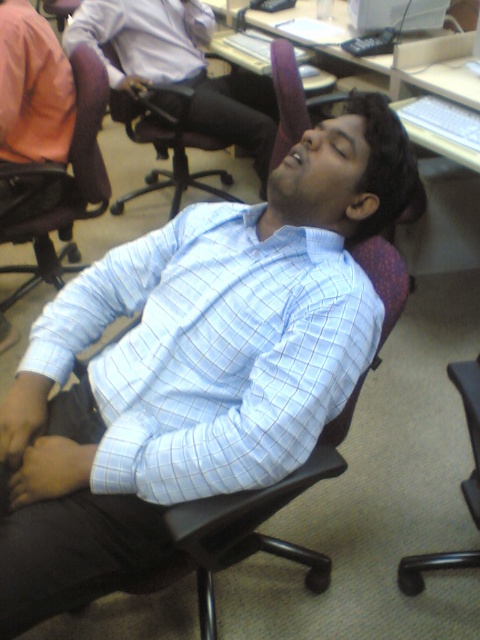
In the office scene, there is a point at coordinates [178,67]. Which object from the list below is located at that point? Choose from the following objects listed in the scene description. The objects are the central figure in the foreground, the matte black laptop at upper center, and the person in orange shirt partially visible on the left side.

The point at coordinates [178,67] is located on the matte black laptop at upper center.

You are an office worker who needs to place a 15 inch laptop stand between the matte black laptop at upper center and the white glossy computer desk at upper center. Can the stand fit in the space between them?

The distance between the matte black laptop at upper center and the white glossy computer desk at upper center is 14.78 inches, which is slightly less than the 15 inch stand. Therefore, the stand cannot fit in the space between them.

You are an office cleaner who needs to reach the brown leather chair at left. There is a light blue checkered shirt at center in the way. Can you move around the shirt to access the chair?

The light blue checkered shirt at center is in front of the brown leather chair at left, so you can move around the shirt to access the chair since it is blocking the path.